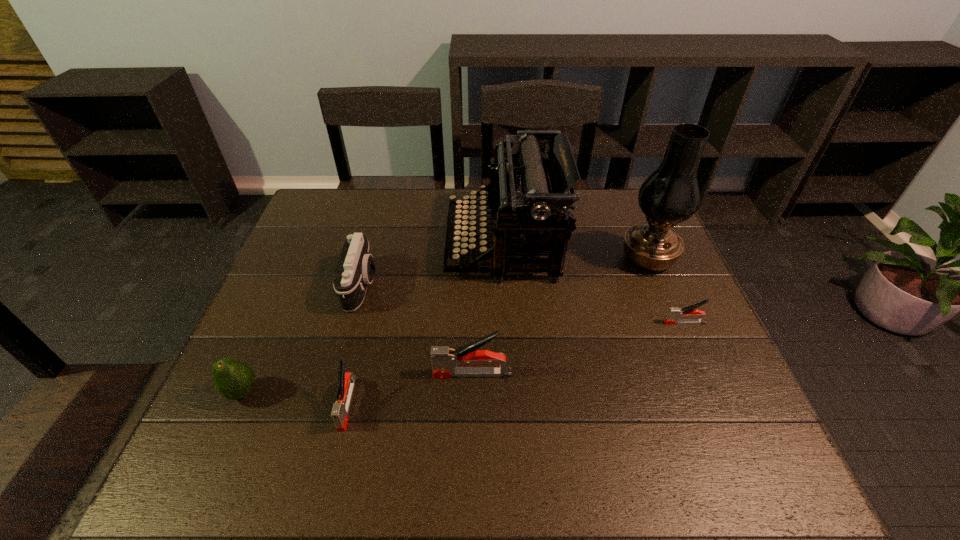
The width and height of the screenshot is (960, 540). Find the location of `vacant spot for a new stapler_(stapling_machine) to ensure equal spacing`. vacant spot for a new stapler_(stapling_machine) to ensure equal spacing is located at coordinates (584, 347).